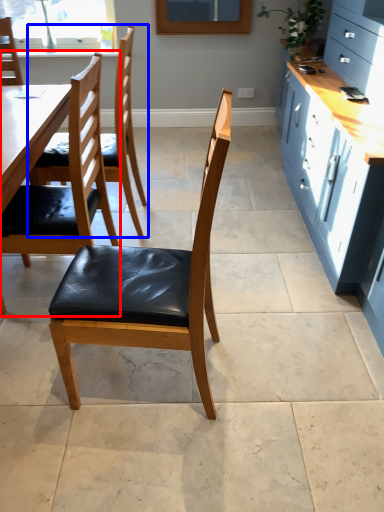
Question: Which object appears closest to the camera in this image, chair (highlighted by a red box) or chair (highlighted by a blue box)?

Choices:
 (A) chair
 (B) chair

Answer: (A)